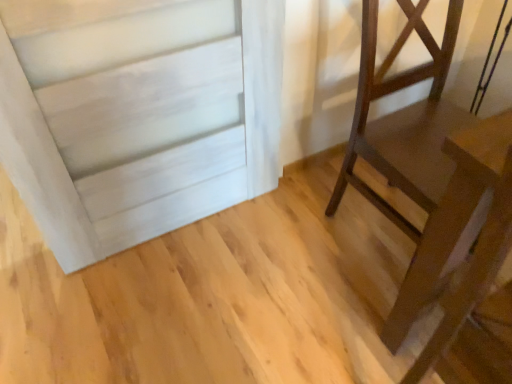
Question: Is wooden table at lower right wider or thinner than dark brown wood chair at right?

Choices:
 (A) thin
 (B) wide

Answer: (A)

Question: Choose the correct answer: Is wooden table at lower right inside dark brown wood chair at right or outside it?

Choices:
 (A) inside
 (B) outside

Answer: (B)

Question: Does point (458, 329) appear closer or farther from the camera than point (418, 150)?

Choices:
 (A) closer
 (B) farther

Answer: (A)

Question: Is point (408, 279) positioned closer to the camera than point (463, 317)?

Choices:
 (A) farther
 (B) closer

Answer: (A)

Question: In terms of size, does dark brown wood chair at right appear bigger or smaller than wooden table at lower right?

Choices:
 (A) small
 (B) big

Answer: (B)

Question: Relative to wooden table at lower right, is dark brown wood chair at right in front or behind?

Choices:
 (A) behind
 (B) front

Answer: (A)

Question: Is dark brown wood chair at right inside or outside of wooden table at lower right?

Choices:
 (A) outside
 (B) inside

Answer: (A)